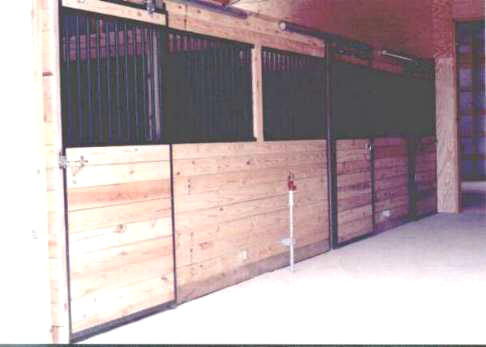
Identify the location of doorframe. This screenshot has width=486, height=347. (446, 153).